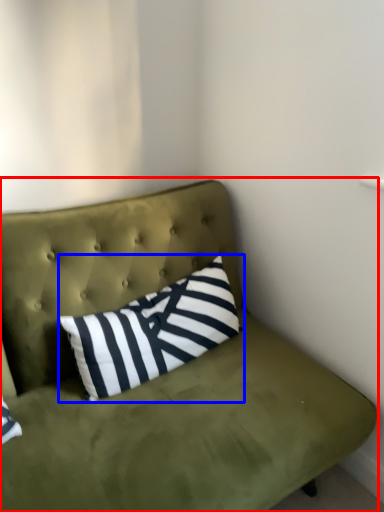
Question: Which object is closer to the camera taking this photo, studio couch (highlighted by a red box) or pillow (highlighted by a blue box)?

Choices:
 (A) studio couch
 (B) pillow

Answer: (A)